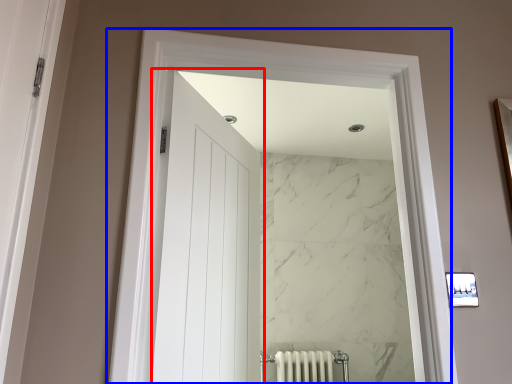
Question: Which object is further to the camera taking this photo, door (highlighted by a red box) or window (highlighted by a blue box)?

Choices:
 (A) door
 (B) window

Answer: (A)